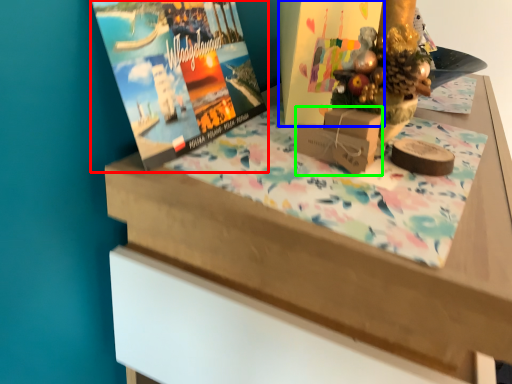
Question: Considering the real-world distances, which object is closest to magazine (highlighted by a red box)? book cover (highlighted by a blue box) or cardboard box (highlighted by a green box).

Choices:
 (A) book cover
 (B) cardboard box

Answer: (A)